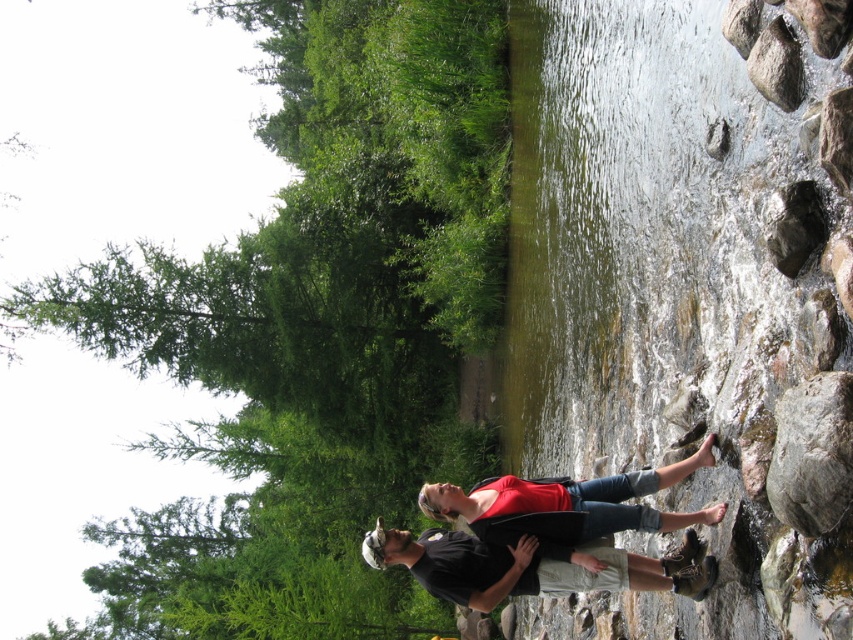
You are planning to buy a new shirt and want to know which one is wider between the black matte shirt at center and the red matte shirt at center. According to the scene, which one is wider?

The black matte shirt at center is wider than the red matte shirt at center according to the description.

You are standing at point [622,525] and want to walk to the river. Is the point [375,534] behind you or in front of you?

The point [375,534] is behind point [622,525], so it is behind you.